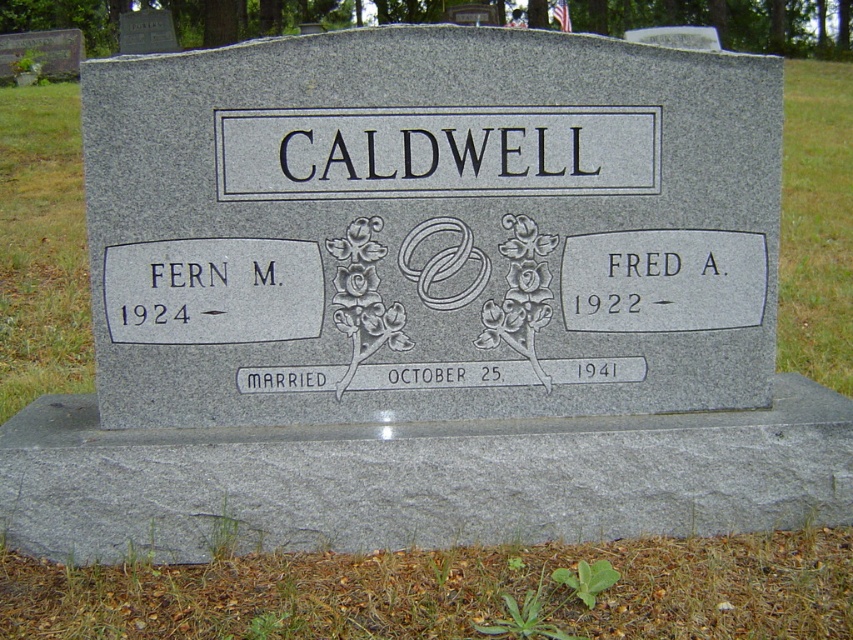
Between black granite sign at center and green leafy weed at lower center, which one appears on the right side from the viewer's perspective?

green leafy weed at lower center is more to the right.

What do you see at coordinates (436, 150) in the screenshot? I see `black granite sign at center` at bounding box center [436, 150].

At what (x,y) coordinates should I click in order to perform the action: click on black granite sign at center. Please return your answer as a coordinate pair (x, y). The height and width of the screenshot is (640, 853). Looking at the image, I should click on (436, 150).